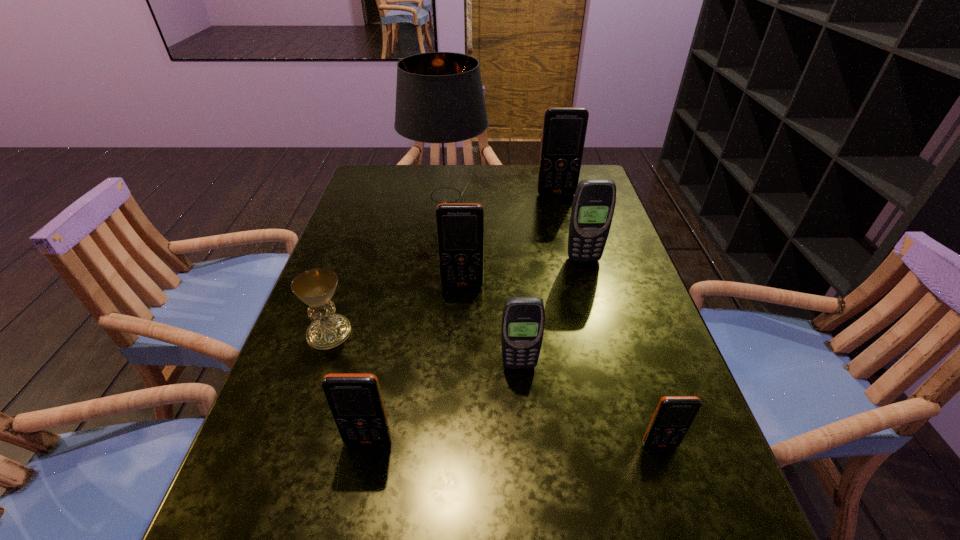
Locate which object ranks in proximity to the leftmost object. Please provide its 2D coordinates. Your answer should be formatted as a tuple, i.e. [(x, y)], where the tuple contains the x and y coordinates of a point satisfying the conditions above.

[(355, 400)]

Select which cellular telephone appears as the fourth closest to the leftmost cellular telephone. Please provide its 2D coordinates. Your answer should be formatted as a tuple, i.e. [(x, y)], where the tuple contains the x and y coordinates of a point satisfying the conditions above.

[(593, 206)]

Locate which cellular telephone ranks in proximity to the farthest orange cellular telephone. Please provide its 2D coordinates. Your answer should be formatted as a tuple, i.e. [(x, y)], where the tuple contains the x and y coordinates of a point satisfying the conditions above.

[(593, 206)]

Locate which orange cellular telephone ranks in proximity to the second cellular telephone from left to right. Please provide its 2D coordinates. Your answer should be formatted as a tuple, i.e. [(x, y)], where the tuple contains the x and y coordinates of a point satisfying the conditions above.

[(355, 400)]

Where is `the third closest orange cellular telephone to the second tallest object`? the third closest orange cellular telephone to the second tallest object is located at coordinates (355, 400).